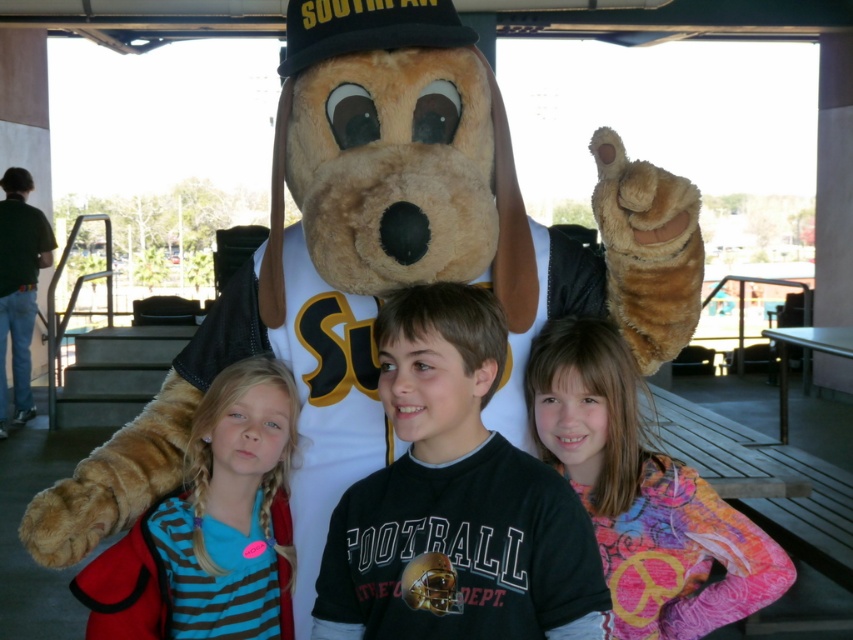
Question: Is black cotton shirt at center smaller than striped fabric shirt at center?

Choices:
 (A) yes
 (B) no

Answer: (B)

Question: Which object appears farthest from the camera in this image?

Choices:
 (A) black cotton shirt at center
 (B) striped fabric shirt at center

Answer: (B)

Question: Does black cotton shirt at center come in front of striped fabric shirt at center?

Choices:
 (A) no
 (B) yes

Answer: (B)

Question: Can you confirm if black cotton shirt at center is positioned to the right of striped fabric shirt at center?

Choices:
 (A) yes
 (B) no

Answer: (A)